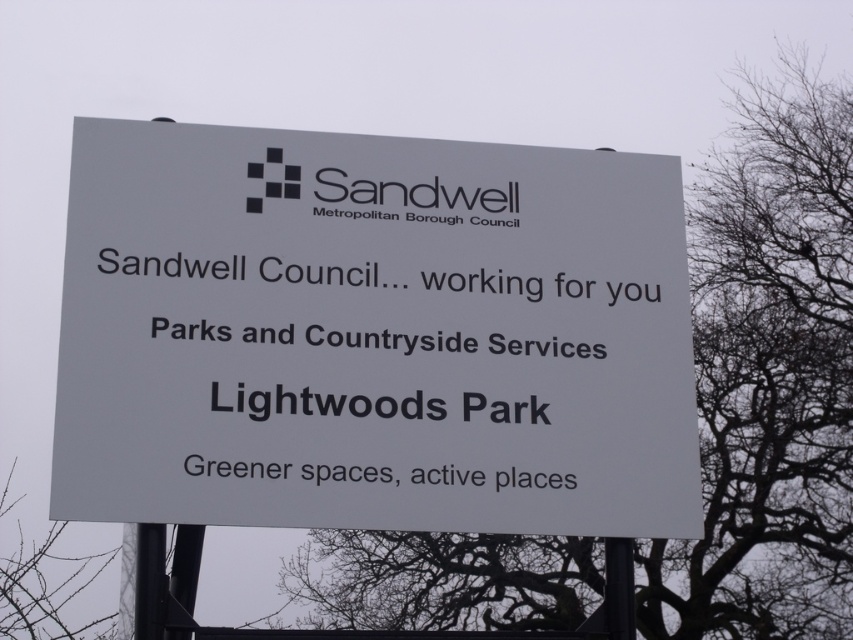
Does point (273, 369) come farther from viewer compared to point (723, 378)?

No, it is not.

What do you see at coordinates (372, 333) in the screenshot? This screenshot has width=853, height=640. I see `white plastic sign at center` at bounding box center [372, 333].

Locate an element on the screen. The height and width of the screenshot is (640, 853). white plastic sign at center is located at coordinates (372, 333).